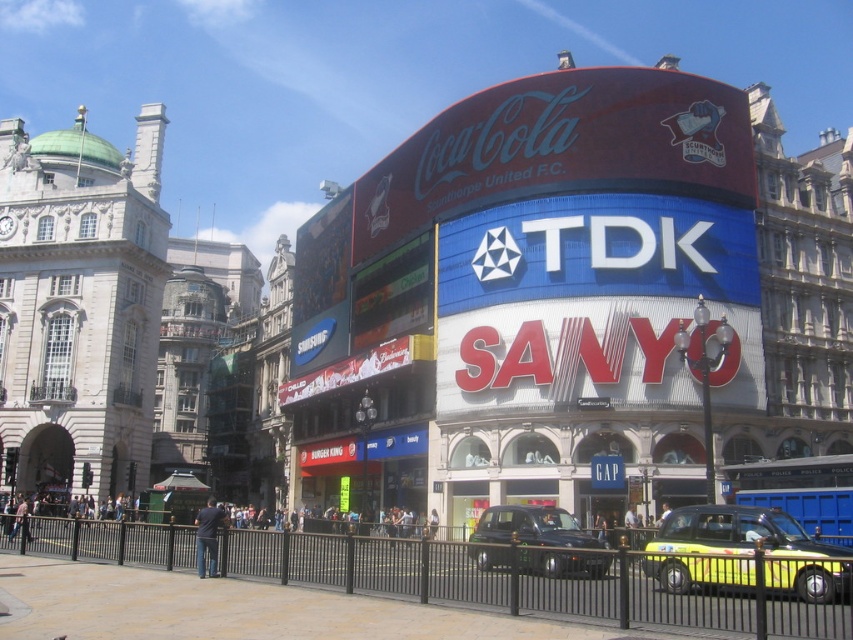
Is black metal fence at lower center above white glossy billboard at center?

Incorrect, black metal fence at lower center is not positioned above white glossy billboard at center.

Does black metal fence at lower center have a greater height compared to white glossy billboard at center?

In fact, black metal fence at lower center may be shorter than white glossy billboard at center.

Locate an element on the screen. This screenshot has height=640, width=853. black metal fence at lower center is located at coordinates (554, 579).

In the scene shown: Can you confirm if yellow metallic taxi at lower right is thinner than metallic silver bus at center?

Yes.

Which of these two, yellow metallic taxi at lower right or metallic silver bus at center, stands taller?

metallic silver bus at center is taller.

Which is behind, point (762, 522) or point (154, 504)?

The point (154, 504) is more distant.

Identify the location of yellow metallic taxi at lower right. (735, 531).

Is point (515, 368) positioned after point (152, 504)?

That is False.

Between red metallic sign at center and metallic silver bus at center, which one has less height?

metallic silver bus at center is shorter.

Is point (508, 330) positioned in front of point (207, 490)?

Yes, it is.

Where is `red metallic sign at center`? The height and width of the screenshot is (640, 853). red metallic sign at center is located at coordinates (566, 355).